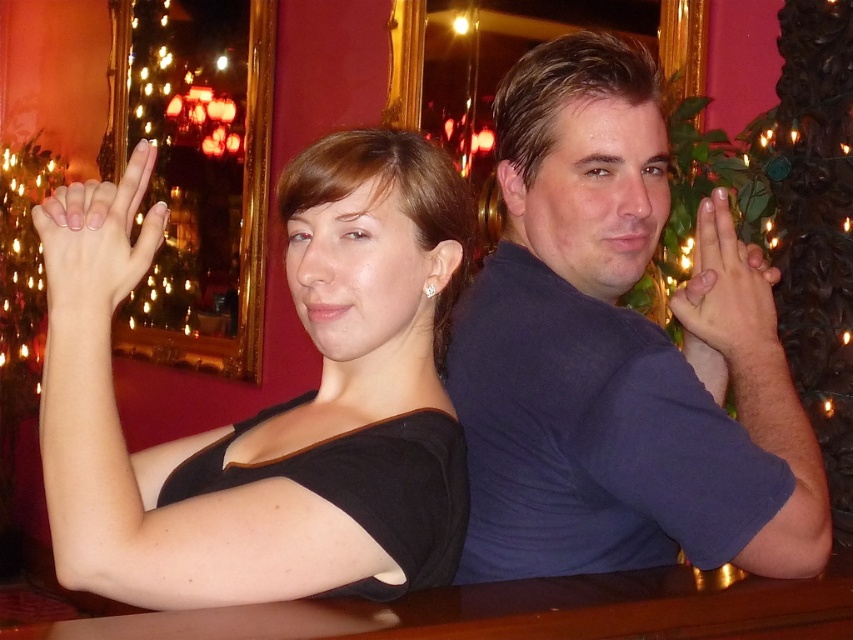
Is matte black top at left smaller than white polished nails at upper left?

Incorrect, matte black top at left is not smaller in size than white polished nails at upper left.

Who is lower down, matte black top at left or white polished nails at upper left?

Positioned lower is matte black top at left.

Identify the location of matte black top at left. The image size is (853, 640). (273, 406).

Is dark blue shirt at center further to camera compared to smooth skin hand at upper right?

No, it is not.

Can you confirm if dark blue shirt at center is thinner than smooth skin hand at upper right?

In fact, dark blue shirt at center might be wider than smooth skin hand at upper right.

Who is more forward, (776,397) or (741,276)?

Point (776,397)

Identify the location of dark blue shirt at center. The height and width of the screenshot is (640, 853). (619, 353).

Who is shorter, white polished nails at upper left or smooth skin hand at upper right?

white polished nails at upper left

Does white polished nails at upper left have a lesser width compared to smooth skin hand at upper right?

In fact, white polished nails at upper left might be wider than smooth skin hand at upper right.

Which is in front, point (68, 291) or point (740, 308)?

Point (68, 291)

Where is `white polished nails at upper left`? The width and height of the screenshot is (853, 640). white polished nails at upper left is located at coordinates (97, 243).